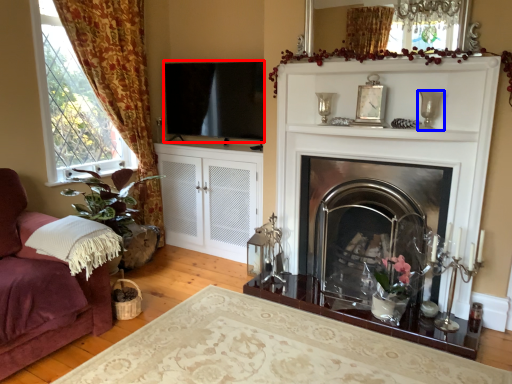
Question: Which object is closer to the camera taking this photo, window screen (highlighted by a red box) or candle holder (highlighted by a blue box)?

Choices:
 (A) window screen
 (B) candle holder

Answer: (B)